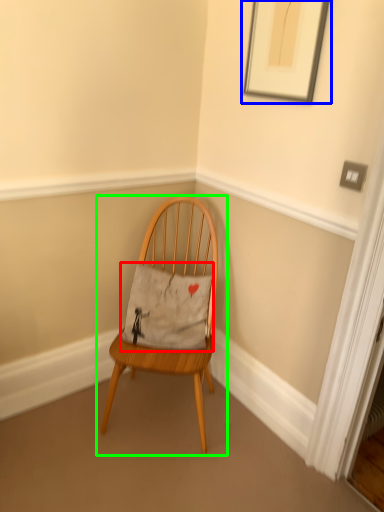
Question: Based on their relative distances, which object is farther from pillow (highlighted by a red box)? Choose from picture frame (highlighted by a blue box) and chair (highlighted by a green box).

Choices:
 (A) picture frame
 (B) chair

Answer: (A)